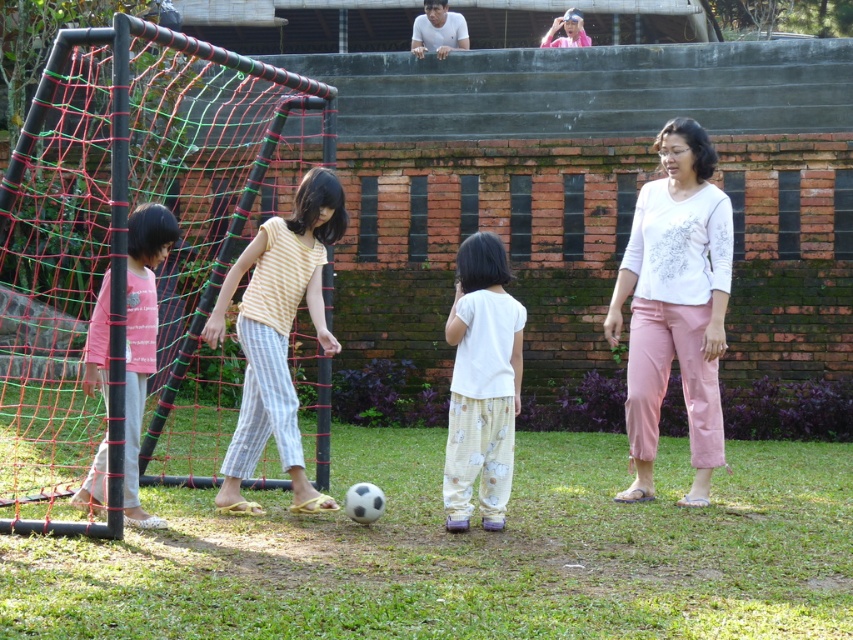
You are a soccer coach standing in the middle of the field. You need to decide whether the distance between the yellow striped shirt at center and the white cotton shirt at center is sufficient for a safe passing play. The minimum safe distance for a pass is 1 meter. Can the players pass the ball safely between them?

The yellow striped shirt at center is 1.27 meters away from the white cotton shirt at center, which exceeds the minimum safe distance of 1 meter. Therefore, the players can pass the ball safely between them.

You are standing at the origin point of the image coordinate system. You see a white cotton shirt at center located at point [480,384]. If you want to walk directly towards the white cotton shirt at center, which direction should you move?

To move directly towards the white cotton shirt at center located at point [480,384], you should move in the direction of the coordinates increasing in both the x and y axes since the point is in the upper right quadrant from the origin.

You are a soccer coach planning to place a cone between the black net at left and the white cotton shirt at center. If the recommended distance between the cone and each object should be at least 2 meters, is this placement possible?

The black net at left and white cotton shirt at center are 4.67 meters apart. To place a cone between them with at least 2 meters from each, the total required distance would be 2m from each side, totaling 4 meters. Since 4.67 meters is greater than 4 meters, yes, the placement is possible.